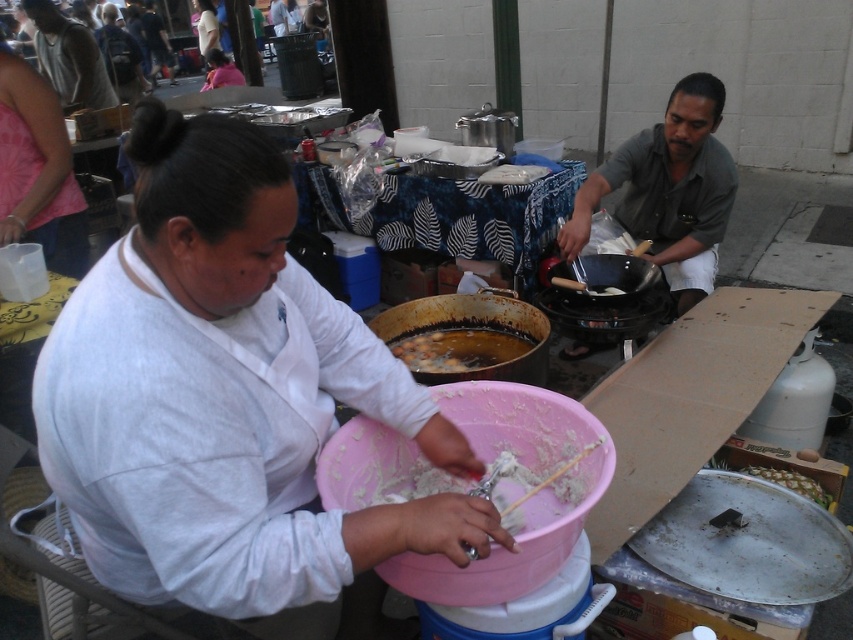
You are a customer looking at the food preparation area. Which object is positioned lower in the scene, the pink matte bowl at center or the gray cotton shirt at upper left?

The pink matte bowl at center is positioned lower than the gray cotton shirt at upper left.

You are a customer looking at the food preparation area. You see the pink matte bowl at center and the gray cotton shirt at upper left. Which object is positioned more to the right side of the scene?

The pink matte bowl at center is positioned to the right of the gray cotton shirt at upper left, so the pink matte bowl at center is more to the right.